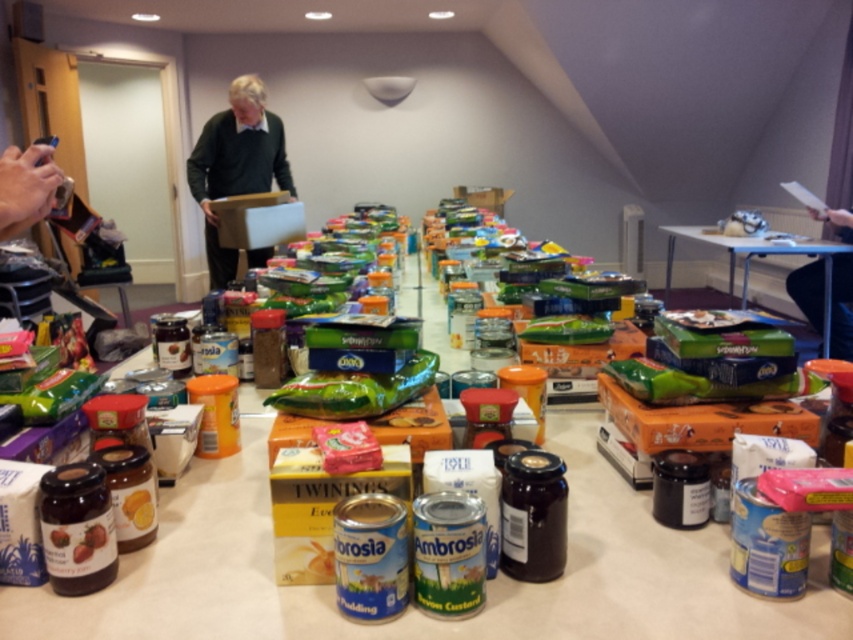
Is green plastic bag at center bigger than green matte bag at center?

Yes.

Image resolution: width=853 pixels, height=640 pixels. Identify the location of green plastic bag at center. (786, 253).

Find the location of a particular element. The width and height of the screenshot is (853, 640). green plastic bag at center is located at coordinates (786, 253).

This screenshot has width=853, height=640. What do you see at coordinates (236, 164) in the screenshot?
I see `green sweater at center` at bounding box center [236, 164].

Which is more to the left, green sweater at center or green plastic bag at center?

green sweater at center is more to the left.

Is point (219, 168) in front of point (701, 234)?

Yes.

This screenshot has width=853, height=640. I want to click on green sweater at center, so click(236, 164).

Between green sweater at center and green matte bag at center, which one appears on the right side from the viewer's perspective?

green matte bag at center

Which is in front, point (245, 182) or point (399, 368)?

Positioned in front is point (399, 368).

You are a GUI agent. You are given a task and a screenshot of the screen. Output one action in this format:
    pyautogui.click(x=<x>, y=<y>)
    Task: Click on the green sweater at center
    The height and width of the screenshot is (640, 853).
    Given the screenshot: What is the action you would take?
    pyautogui.click(x=236, y=164)